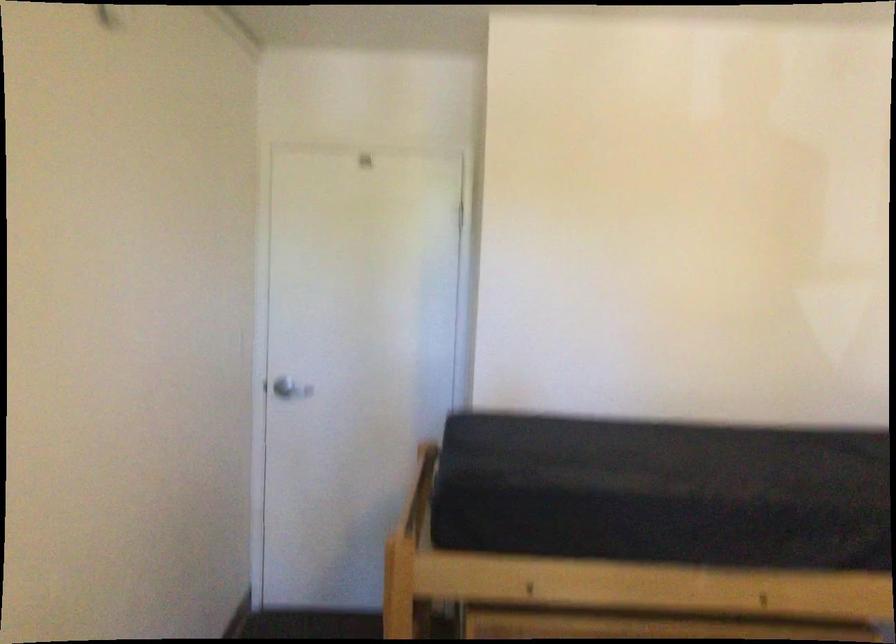
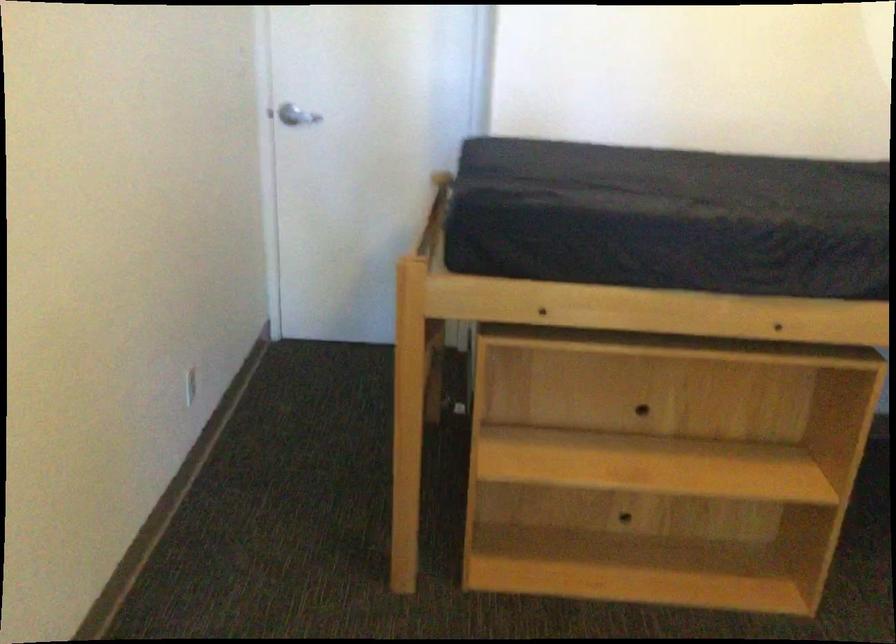
Find the pixel in the second image that matches the point at 279,383 in the first image.

(287, 115)